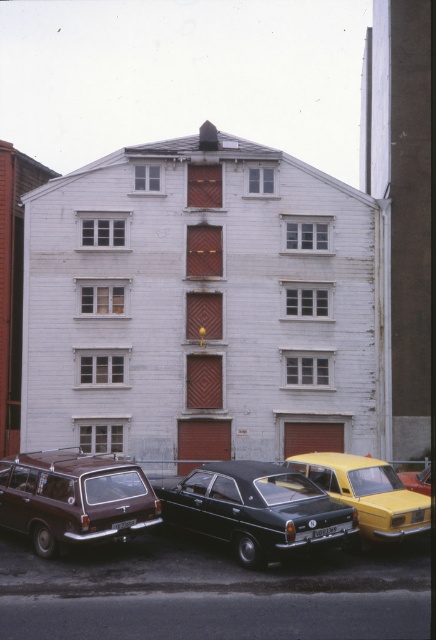
From the picture: You are standing in front of the residential building and want to park your car. The parking spot at point (74, 499) is available. Can you park your car there if your car is the same size as the brown matte station wagon at lower left?

Yes, you can park your car at point (74, 499) because the brown matte station wagon at lower left is already parked there, indicating the space is suitable for its size.

You are a delivery person with a cart that is 2 meters wide. You need to move from the shiny black sedan at center to the brown matte station wagon at lower left. Can your cart fit through the space between them?

The shiny black sedan at center and the brown matte station wagon at lower left are 2.27 meters apart. Since your cart is 2 meters wide, it can fit through the space between them as the distance is greater than the cart width.